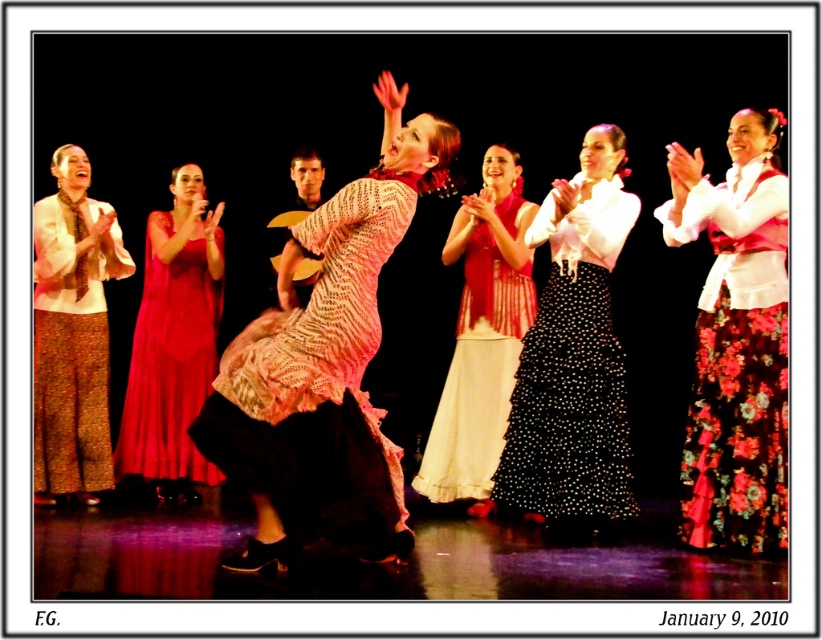
Question: Considering the real-world distances, which object is farthest from the floral cotton skirt at center?

Choices:
 (A) red floral dress at center
 (B) matte red dress at center
 (C) black dotted skirt at center
 (D) printed silk dress at center

Answer: (B)

Question: Which of the following is the closest to the observer?

Choices:
 (A) (95, 429)
 (B) (612, 348)
 (C) (492, 484)
 (D) (259, 324)

Answer: (D)

Question: Which point is closer to the camera?

Choices:
 (A) printed silk dress at center
 (B) black dotted skirt at center
 (C) matte brown skirt at center
 (D) red floral dress at center

Answer: (A)

Question: Is printed silk dress at center positioned in front of red floral dress at center?

Choices:
 (A) yes
 (B) no

Answer: (A)

Question: Can you confirm if matte brown skirt at center is positioned above red floral dress at center?

Choices:
 (A) yes
 (B) no

Answer: (B)

Question: In this image, where is printed silk dress at center located relative to matte red dress at center?

Choices:
 (A) left
 (B) right

Answer: (B)